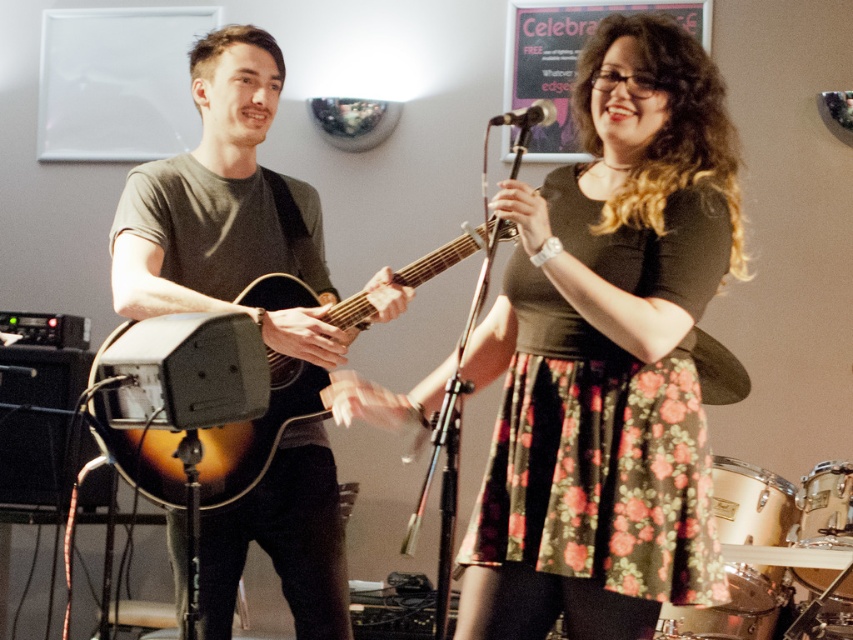
You are a GUI agent. You are given a task and a screenshot of the screen. Output one action in this format:
    pyautogui.click(x=<x>, y=<y>)
    Task: Click on the matte brown guitar at left
    The width and height of the screenshot is (853, 640).
    Given the screenshot: What is the action you would take?
    pyautogui.click(x=216, y=195)

Where is `matte brown guitar at left`? matte brown guitar at left is located at coordinates (216, 195).

Can you confirm if matte brown guitar at left is wider than sunburst wood acoustic guitar at center?

Incorrect, matte brown guitar at left's width does not surpass sunburst wood acoustic guitar at center's.

Is point (273, 522) behind point (277, 276)?

Yes, it is behind point (277, 276).

Where is `matte brown guitar at left`? matte brown guitar at left is located at coordinates (216, 195).

Does sunburst wood acoustic guitar at center appear on the right side of metallic silver microphone at upper center?

In fact, sunburst wood acoustic guitar at center is to the left of metallic silver microphone at upper center.

Which is in front, point (302, 284) or point (550, 116)?

Point (550, 116) is in front.

Does point (292, 417) lie in front of point (492, 122)?

That is False.

This screenshot has width=853, height=640. Identify the location of sunburst wood acoustic guitar at center. (258, 432).